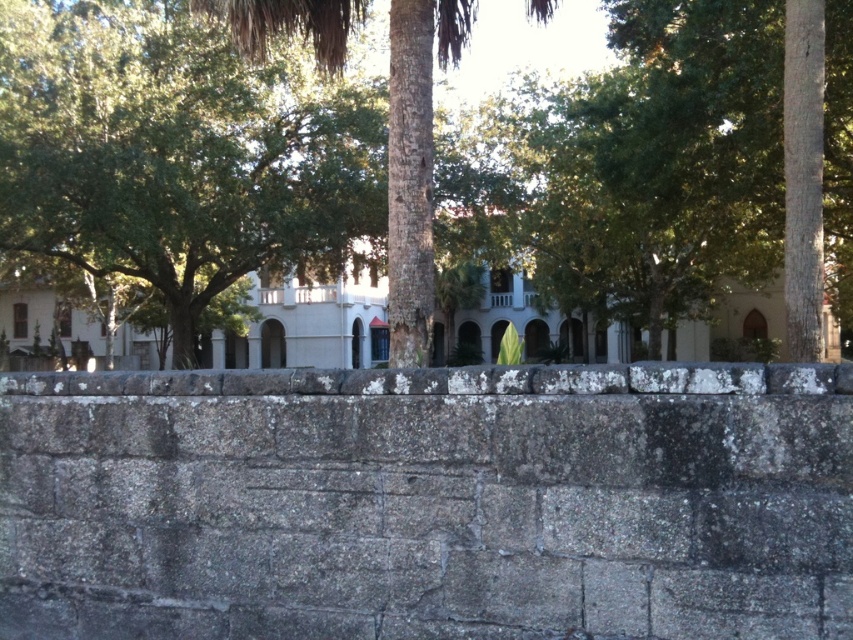
Question: Where is green leafy tree at center located in relation to bark textured palm tree at center in the image?

Choices:
 (A) below
 (B) above

Answer: (A)

Question: Which object is closer to the camera taking this photo?

Choices:
 (A) bark textured palm tree at center
 (B) green leafy tree at center

Answer: (B)

Question: Is green leafy tree at center further to the viewer compared to bark textured palm tree at center?

Choices:
 (A) yes
 (B) no

Answer: (B)

Question: Observing the image, what is the correct spatial positioning of green leafy tree at center in reference to bark textured palm tree at center?

Choices:
 (A) above
 (B) below

Answer: (B)